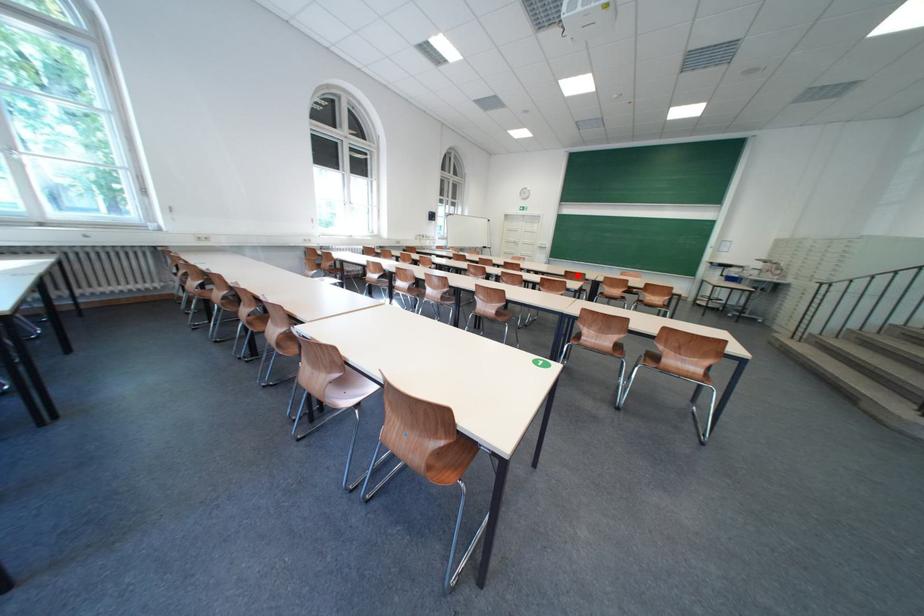
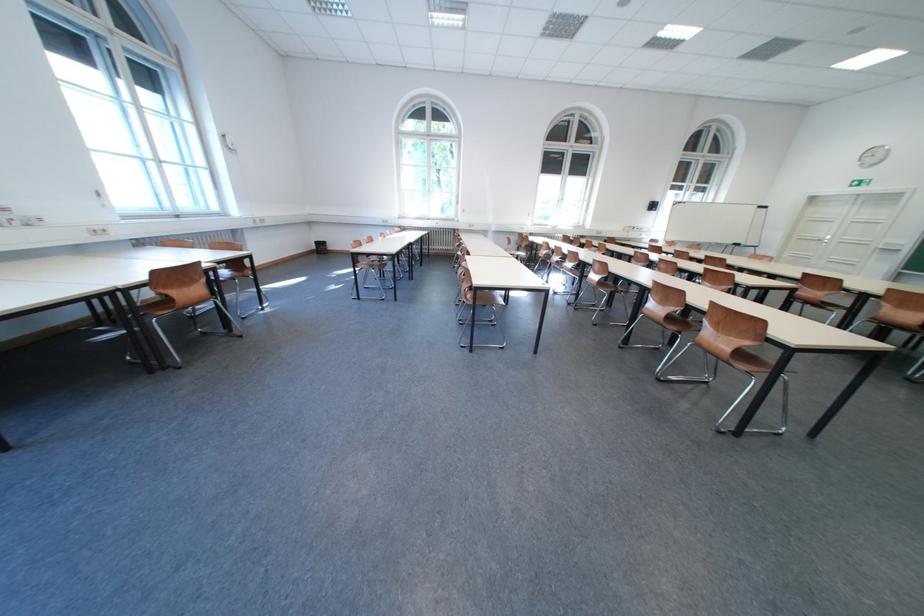
Question: A red point is marked in image1. In image2, is the corresponding 3D point closer to the camera or farther? Reply with the corresponding letter.

Choices:
 (A) The corresponding 3D point is closer.
 (B) The corresponding 3D point is farther.

Answer: (A)